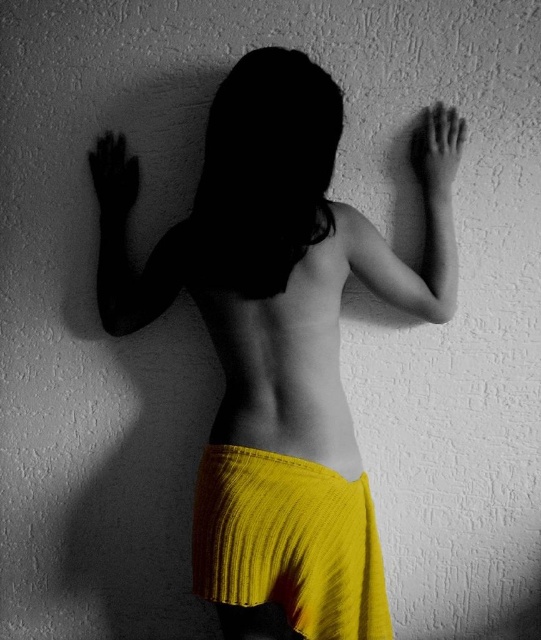
You are an artist analyzing this black and white photo with a yellow element. You notice the yellow pleated skirt at center and the smooth skin hand at upper right. Which object occupies a larger vertical space in the image?

The yellow pleated skirt at center is much taller than the smooth skin hand at upper right, so it occupies a larger vertical space in the image.

You are an artist analyzing the composition of this black and white photograph with a yellow element. You notice two hands in the image. The smooth skin hand at upper right and the black matte hand at left. Which hand appears thinner in the photograph?

The smooth skin hand at upper right appears thinner than the black matte hand at left in the photograph.